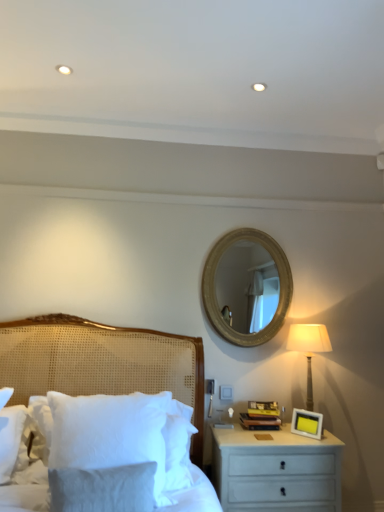
Question: In terms of height, does white woven bed at left look taller or shorter compared to yellow matte picture frame at right?

Choices:
 (A) short
 (B) tall

Answer: (B)

Question: Is white woven bed at left spatially inside yellow matte picture frame at right, or outside of it?

Choices:
 (A) outside
 (B) inside

Answer: (A)

Question: Which object is the farthest from the white painted wood nightstand at lower right?

Choices:
 (A) yellow matte picture frame at right
 (B) matte beige lamp at right
 (C) gold textured mirror at upper center
 (D) white fluffy pillow at lower left
 (E) white woven bed at left

Answer: (C)

Question: Based on their relative distances, which object is nearer to the yellow matte picture frame at right?

Choices:
 (A) white painted wood nightstand at lower right
 (B) white fluffy pillow at lower left
 (C) white woven bed at left
 (D) matte beige lamp at right
 (E) gold textured mirror at upper center

Answer: (A)